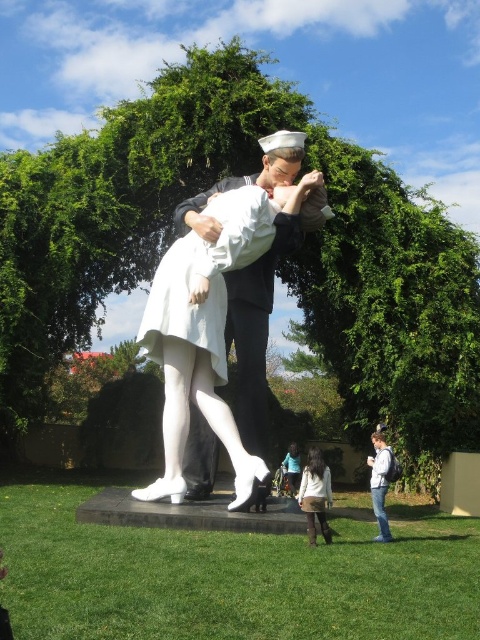
You are an art student analyzing the sculpture. You notice two white elements in the scene. Which one is located to the left of the other? The white glossy statue at center and the white matte skirt at lower center.

The white glossy statue at center is positioned on the left side of white matte skirt at lower center.

In the scene shown: You are standing at the point labeled point (x=184, y=218) and want to walk to the point labeled point (x=317, y=465). Which direction should you move to get closer to your destination?

To move from point (x=184, y=218) to point (x=317, y=465), you should move towards the northeast direction since point (x=317, y=465) is northeast of point (x=184, y=218).

You are an art curator planning to display the white glossy statue at center and the white matte dress at center in a gallery. Given their widths, which object should be placed on a wider base to ensure stability?

The white glossy statue at center should be placed on a wider base because its width surpasses that of the white matte dress at center, requiring more support for stability.